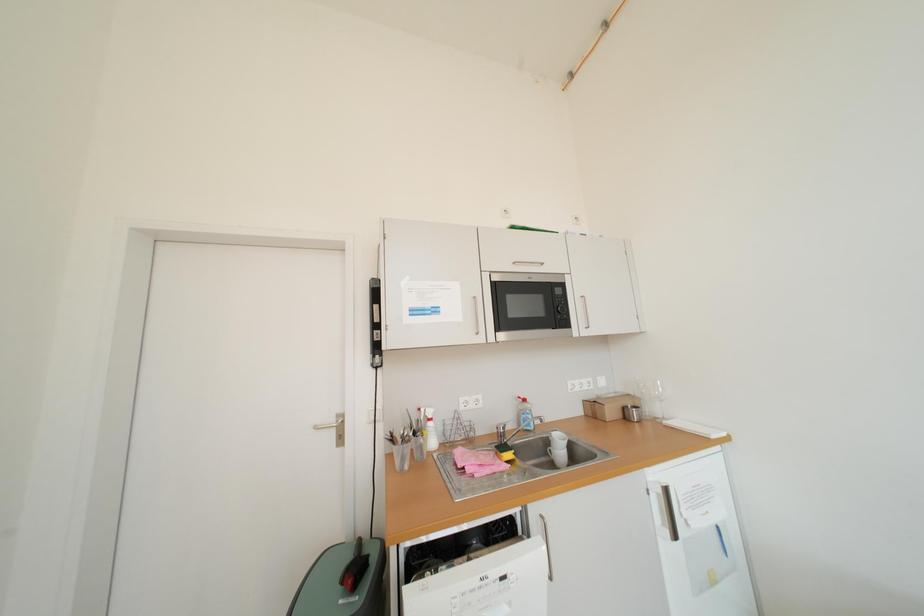
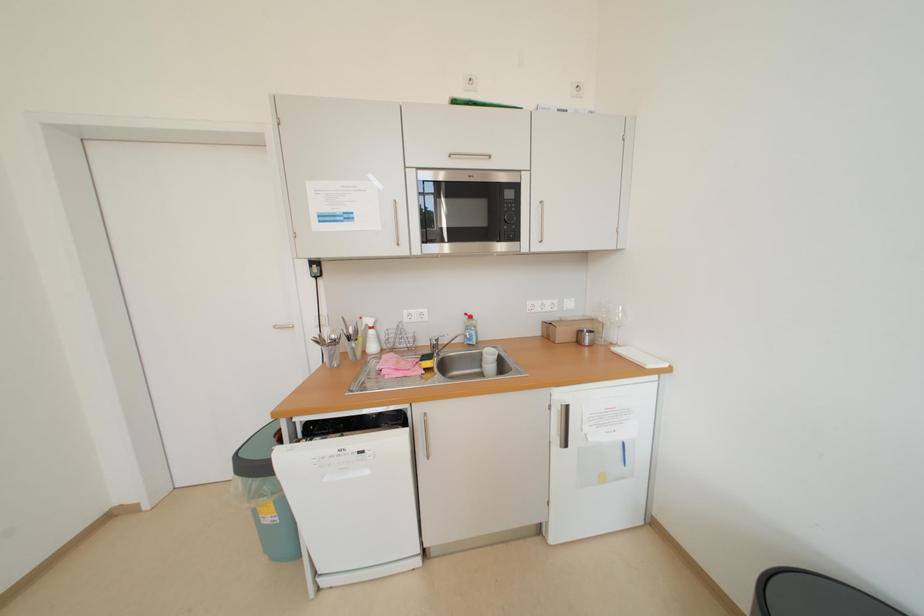
Question: Based on the continuous images, in which direction is the camera rotating? Reply with the corresponding letter.

Choices:
 (A) Left
 (B) Right
 (C) Up
 (D) Down

Answer: (D)